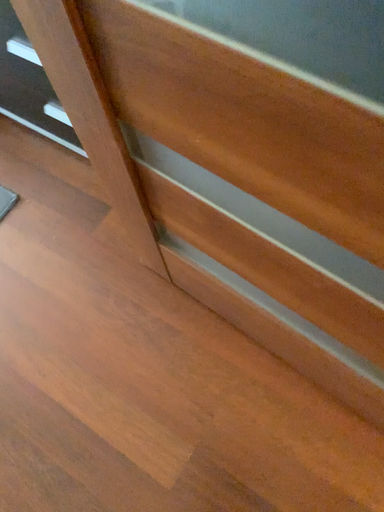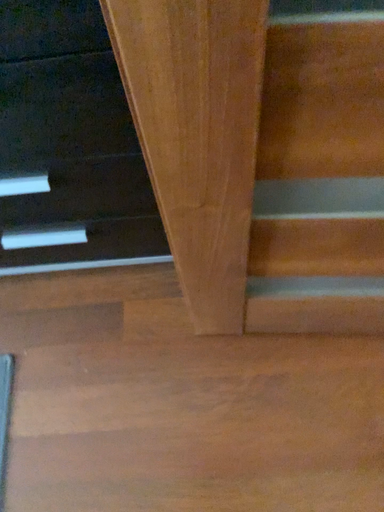
Question: Which way did the camera rotate in the video?

Choices:
 (A) rotated upward
 (B) rotated downward

Answer: (A)